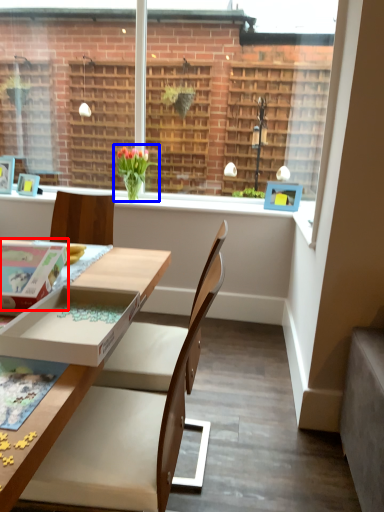
Question: Which object appears farthest to the camera in this image, box (highlighted by a red box) or houseplant (highlighted by a blue box)?

Choices:
 (A) box
 (B) houseplant

Answer: (B)